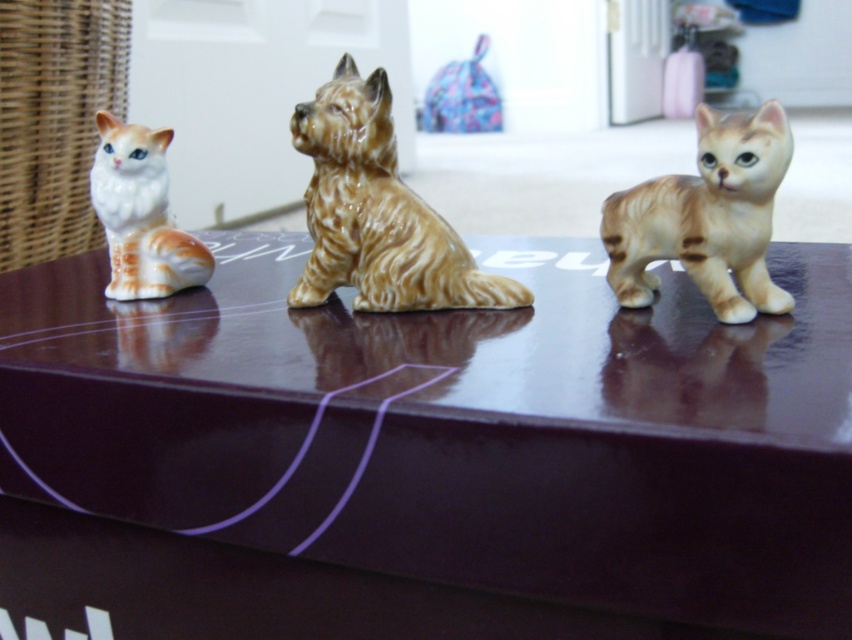
Question: Does matte orange cat at right lie behind white glossy cat at left?

Choices:
 (A) no
 (B) yes

Answer: (A)

Question: Among these points, which one is farthest from the camera?

Choices:
 (A) (617, 193)
 (B) (119, 317)
 (C) (396, 228)
 (D) (131, 192)

Answer: (D)

Question: Does glossy brown table at center have a lesser width compared to white glossy cat at left?

Choices:
 (A) no
 (B) yes

Answer: (A)

Question: Which object is the closest to the matte orange cat at right?

Choices:
 (A) brown glossy dog at center
 (B) glossy brown table at center

Answer: (A)

Question: Is brown glossy dog at center below matte orange cat at right?

Choices:
 (A) yes
 (B) no

Answer: (B)

Question: Which object is farther from the camera taking this photo?

Choices:
 (A) white glossy cat at left
 (B) glossy brown table at center
 (C) brown glossy dog at center
 (D) matte orange cat at right

Answer: (A)